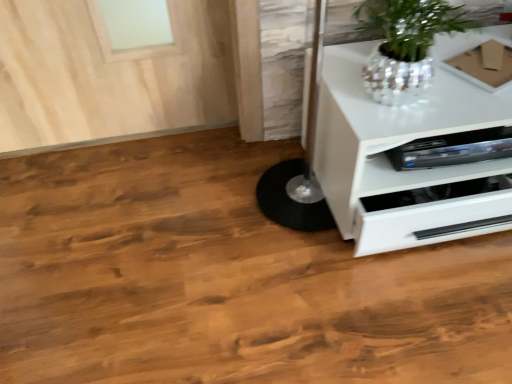
Question: Is white glossy chest of drawers at lower right inside or outside of shiny metallic pot at upper right?

Choices:
 (A) inside
 (B) outside

Answer: (B)

Question: In terms of size, does white glossy chest of drawers at lower right appear bigger or smaller than shiny metallic pot at upper right?

Choices:
 (A) small
 (B) big

Answer: (B)

Question: Which of these objects is positioned closest to the brown cardboard box at upper right?

Choices:
 (A) shiny metallic pot at upper right
 (B) white glossy chest of drawers at lower right

Answer: (A)

Question: Estimate the real-world distances between objects in this image. Which object is closer to the brown cardboard box at upper right?

Choices:
 (A) white glossy chest of drawers at lower right
 (B) shiny metallic pot at upper right

Answer: (B)